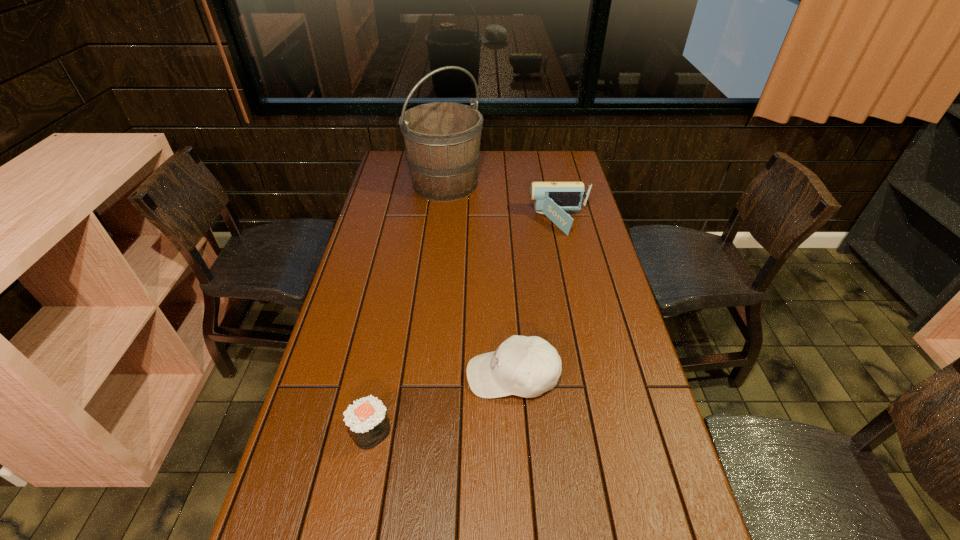
At what (x,y) coordinates should I click in order to perform the action: click on vacant space located on the front-facing side of the baseball cap. Please return your answer as a coordinate pair (x, y). Looking at the image, I should click on (322, 375).

You are a GUI agent. You are given a task and a screenshot of the screen. Output one action in this format:
    pyautogui.click(x=<x>, y=<y>)
    Task: Click on the vacant space situated on the front-facing side of the baseball cap
    Image resolution: width=960 pixels, height=540 pixels.
    Given the screenshot: What is the action you would take?
    pyautogui.click(x=365, y=375)

The height and width of the screenshot is (540, 960). I want to click on free location located on the front-facing side of the baseball cap, so click(420, 375).

Where is `vacant point located on the back of the sushi`? The height and width of the screenshot is (540, 960). vacant point located on the back of the sushi is located at coordinates (392, 318).

This screenshot has height=540, width=960. Identify the location of object present at the far edge. (442, 139).

Find the location of a particular element. This screenshot has height=540, width=960. bucket located in the left edge section of the desktop is located at coordinates pyautogui.click(x=442, y=139).

In order to click on sushi situated at the left edge in this screenshot , I will do `click(366, 418)`.

You are a GUI agent. You are given a task and a screenshot of the screen. Output one action in this format:
    pyautogui.click(x=<x>, y=<y>)
    Task: Click on the object present at the right edge
    This screenshot has width=960, height=540.
    Given the screenshot: What is the action you would take?
    pyautogui.click(x=550, y=198)

Image resolution: width=960 pixels, height=540 pixels. What are the coordinates of `object that is positioned at the far left corner` in the screenshot? It's located at (442, 139).

Locate an element on the screen. The height and width of the screenshot is (540, 960). vacant space at the far edge is located at coordinates (499, 173).